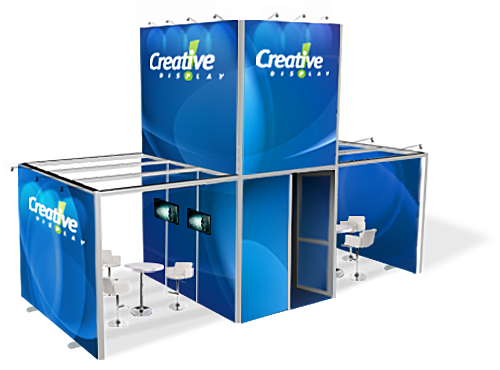
The image size is (500, 370). I want to click on monitor, so click(199, 224), click(160, 212).